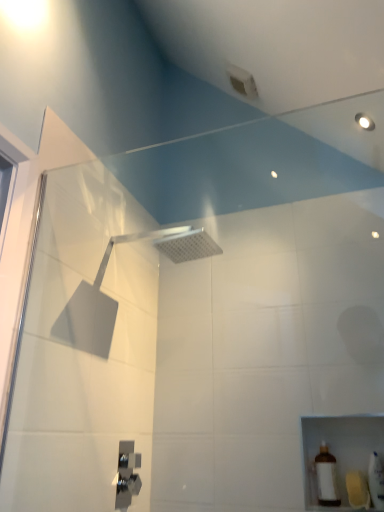
Image resolution: width=384 pixels, height=512 pixels. I want to click on white glossy bottle at lower right, acting as the first toiletry starting from the right, so click(376, 481).

This screenshot has width=384, height=512. What do you see at coordinates (376, 481) in the screenshot?
I see `white glossy bottle at lower right, acting as the first toiletry starting from the right` at bounding box center [376, 481].

This screenshot has height=512, width=384. Describe the element at coordinates (167, 246) in the screenshot. I see `silver metallic shower head at upper center, the first shower from the top` at that location.

The image size is (384, 512). Describe the element at coordinates (127, 474) in the screenshot. I see `satin nickel faucet at lower center, acting as the first shower starting from the bottom` at that location.

You are a GUI agent. You are given a task and a screenshot of the screen. Output one action in this format:
    pyautogui.click(x=<x>, y=<y>)
    Task: Click on the brown matte bottle at lower right, placed as the 1th toiletry when sorted from left to right
    
    Given the screenshot: What is the action you would take?
    pyautogui.click(x=327, y=477)

From the image's perspective, is satin nickel faucet at lower center, which appears as the 2th shower when viewed from the right, above silver metallic shower head at upper center, arranged as the 2th shower when viewed from the left?

No, from the image's perspective, satin nickel faucet at lower center, which appears as the 2th shower when viewed from the right, is not on top of silver metallic shower head at upper center, arranged as the 2th shower when viewed from the left.

Between satin nickel faucet at lower center, marked as the first shower in a left-to-right arrangement, and silver metallic shower head at upper center, the first shower from the top, which one has less height?

With less height is silver metallic shower head at upper center, the first shower from the top.

Which is behind, point (127, 466) or point (203, 234)?

The point (127, 466) is farther from the camera.

Find the location of a particular element. shower on the left of silver metallic shower head at upper center, marked as the second shower in a bottom-to-top arrangement is located at coordinates (127, 474).

Looking at this image, is white glossy bottle at lower right, the second toiletry when ordered from left to right, positioned far away from brown matte bottle at lower right, placed as the 1th toiletry when sorted from left to right?

Actually, white glossy bottle at lower right, the second toiletry when ordered from left to right, and brown matte bottle at lower right, placed as the 1th toiletry when sorted from left to right, are a little close together.

Which object is thinner, white glossy bottle at lower right, acting as the first toiletry starting from the right, or brown matte bottle at lower right, placed as the 1th toiletry when sorted from left to right?

brown matte bottle at lower right, placed as the 1th toiletry when sorted from left to right.

Looking at this image, is white glossy bottle at lower right, the second toiletry when ordered from left to right, facing away from brown matte bottle at lower right, placed as the 1th toiletry when sorted from left to right?

white glossy bottle at lower right, the second toiletry when ordered from left to right, is not turned away from brown matte bottle at lower right, placed as the 1th toiletry when sorted from left to right.

Does silver metallic shower head at upper center, the first shower from the top, have a larger size compared to brown matte bottle at lower right, placed as the 1th toiletry when sorted from left to right?

Correct, silver metallic shower head at upper center, the first shower from the top, is larger in size than brown matte bottle at lower right, placed as the 1th toiletry when sorted from left to right.

Visually, is silver metallic shower head at upper center, marked as the second shower in a bottom-to-top arrangement, positioned to the left or to the right of brown matte bottle at lower right, placed as the 1th toiletry when sorted from left to right?

In the image, silver metallic shower head at upper center, marked as the second shower in a bottom-to-top arrangement, appears on the left side of brown matte bottle at lower right, placed as the 1th toiletry when sorted from left to right.

Which is correct: silver metallic shower head at upper center, marked as the second shower in a bottom-to-top arrangement, is inside brown matte bottle at lower right, placed as the 1th toiletry when sorted from left to right, or outside of it?

silver metallic shower head at upper center, marked as the second shower in a bottom-to-top arrangement, is not enclosed by brown matte bottle at lower right, placed as the 1th toiletry when sorted from left to right.

From the image's perspective, is silver metallic shower head at upper center, marked as the second shower in a bottom-to-top arrangement, on top of brown matte bottle at lower right, placed as the 1th toiletry when sorted from left to right?

Yes, from the image's perspective, silver metallic shower head at upper center, marked as the second shower in a bottom-to-top arrangement, is over brown matte bottle at lower right, placed as the 1th toiletry when sorted from left to right.

Who is bigger, satin nickel faucet at lower center, acting as the first shower starting from the bottom, or brown matte bottle at lower right, placed as the 1th toiletry when sorted from left to right?

brown matte bottle at lower right, placed as the 1th toiletry when sorted from left to right.

Is brown matte bottle at lower right, placed as the 1th toiletry when sorted from left to right, inside satin nickel faucet at lower center, placed as the second shower when sorted from top to bottom?

No, brown matte bottle at lower right, placed as the 1th toiletry when sorted from left to right, is not surrounded by satin nickel faucet at lower center, placed as the second shower when sorted from top to bottom.

Is satin nickel faucet at lower center, which appears as the 2th shower when viewed from the right, in front of or behind brown matte bottle at lower right, placed as the 1th toiletry when sorted from left to right, in the image?

Clearly, satin nickel faucet at lower center, which appears as the 2th shower when viewed from the right, is in front of brown matte bottle at lower right, placed as the 1th toiletry when sorted from left to right.

Can you tell me how much satin nickel faucet at lower center, which appears as the 2th shower when viewed from the right, and brown matte bottle at lower right, placed as the 1th toiletry when sorted from left to right, differ in facing direction?

The angular difference between satin nickel faucet at lower center, which appears as the 2th shower when viewed from the right, and brown matte bottle at lower right, placed as the 1th toiletry when sorted from left to right, is 90 degrees.

Is satin nickel faucet at lower center, placed as the second shower when sorted from top to bottom, facing towards white glossy bottle at lower right, acting as the first toiletry starting from the right?

Yes.

Considering the points (128, 478) and (378, 492), which point is in front, point (128, 478) or point (378, 492)?

The point (378, 492) is more forward.

From their relative heights in the image, would you say satin nickel faucet at lower center, acting as the first shower starting from the bottom, is taller or shorter than white glossy bottle at lower right, the second toiletry when ordered from left to right?

Clearly, satin nickel faucet at lower center, acting as the first shower starting from the bottom, is taller compared to white glossy bottle at lower right, the second toiletry when ordered from left to right.

Is satin nickel faucet at lower center, marked as the first shower in a left-to-right arrangement, wider than white glossy bottle at lower right, the second toiletry when ordered from left to right?

Incorrect, the width of satin nickel faucet at lower center, marked as the first shower in a left-to-right arrangement, does not surpass that of white glossy bottle at lower right, the second toiletry when ordered from left to right.

Is white glossy bottle at lower right, the second toiletry when ordered from left to right, far away from satin nickel faucet at lower center, marked as the first shower in a left-to-right arrangement?

They are positioned close to each other.

Can you confirm if white glossy bottle at lower right, acting as the first toiletry starting from the right, is wider than satin nickel faucet at lower center, placed as the second shower when sorted from top to bottom?

Yes, white glossy bottle at lower right, acting as the first toiletry starting from the right, is wider than satin nickel faucet at lower center, placed as the second shower when sorted from top to bottom.

Considering the relative sizes of white glossy bottle at lower right, the second toiletry when ordered from left to right, and satin nickel faucet at lower center, which appears as the 2th shower when viewed from the right, in the image provided, is white glossy bottle at lower right, the second toiletry when ordered from left to right, bigger than satin nickel faucet at lower center, which appears as the 2th shower when viewed from the right,?

Yes, white glossy bottle at lower right, the second toiletry when ordered from left to right, is bigger than satin nickel faucet at lower center, which appears as the 2th shower when viewed from the right.

Is white glossy bottle at lower right, acting as the first toiletry starting from the right, closer to the viewer compared to satin nickel faucet at lower center, placed as the second shower when sorted from top to bottom?

Yes.

From a real-world perspective, is brown matte bottle at lower right, marked as the second toiletry in a right-to-left arrangement, above or below satin nickel faucet at lower center, marked as the first shower in a left-to-right arrangement?

Clearly, from a real-world perspective, brown matte bottle at lower right, marked as the second toiletry in a right-to-left arrangement, is below satin nickel faucet at lower center, marked as the first shower in a left-to-right arrangement.

Is brown matte bottle at lower right, marked as the second toiletry in a right-to-left arrangement, positioned with its back to satin nickel faucet at lower center, placed as the second shower when sorted from top to bottom?

brown matte bottle at lower right, marked as the second toiletry in a right-to-left arrangement, is not turned away from satin nickel faucet at lower center, placed as the second shower when sorted from top to bottom.

Which of these two, brown matte bottle at lower right, placed as the 1th toiletry when sorted from left to right, or satin nickel faucet at lower center, marked as the first shower in a left-to-right arrangement, is wider?

brown matte bottle at lower right, placed as the 1th toiletry when sorted from left to right.

From the image's perspective, count 1st showers upward from the brown matte bottle at lower right, marked as the second toiletry in a right-to-left arrangement, and point to it. Please provide its 2D coordinates.

[(127, 474)]

This screenshot has height=512, width=384. In order to click on shower that is above the satin nickel faucet at lower center, which appears as the 2th shower when viewed from the right (from a real-world perspective) in this screenshot , I will do `click(167, 246)`.

Image resolution: width=384 pixels, height=512 pixels. In order to click on toiletry lying on the right of brown matte bottle at lower right, marked as the second toiletry in a right-to-left arrangement in this screenshot , I will do `click(376, 481)`.

Based on their spatial positions, is white glossy bottle at lower right, acting as the first toiletry starting from the right, or silver metallic shower head at upper center, marked as the second shower in a bottom-to-top arrangement, further from brown matte bottle at lower right, placed as the 1th toiletry when sorted from left to right?

Among the two, silver metallic shower head at upper center, marked as the second shower in a bottom-to-top arrangement, is located further to brown matte bottle at lower right, placed as the 1th toiletry when sorted from left to right.

When comparing their distances from satin nickel faucet at lower center, placed as the second shower when sorted from top to bottom, does white glossy bottle at lower right, acting as the first toiletry starting from the right, or brown matte bottle at lower right, marked as the second toiletry in a right-to-left arrangement, seem closer?

brown matte bottle at lower right, marked as the second toiletry in a right-to-left arrangement, is positioned closer to the anchor satin nickel faucet at lower center, placed as the second shower when sorted from top to bottom.

Based on their spatial positions, is brown matte bottle at lower right, marked as the second toiletry in a right-to-left arrangement, or satin nickel faucet at lower center, marked as the first shower in a left-to-right arrangement, closer to silver metallic shower head at upper center, which is the first shower from right to left?

satin nickel faucet at lower center, marked as the first shower in a left-to-right arrangement, lies closer to silver metallic shower head at upper center, which is the first shower from right to left, than the other object.

From the image, which object appears to be nearer to silver metallic shower head at upper center, the first shower from the top, white glossy bottle at lower right, acting as the first toiletry starting from the right, or satin nickel faucet at lower center, placed as the second shower when sorted from top to bottom?

Based on the image, satin nickel faucet at lower center, placed as the second shower when sorted from top to bottom, appears to be nearer to silver metallic shower head at upper center, the first shower from the top.

From the image, which object appears to be nearer to white glossy bottle at lower right, acting as the first toiletry starting from the right, brown matte bottle at lower right, marked as the second toiletry in a right-to-left arrangement, or silver metallic shower head at upper center, the first shower from the top?

brown matte bottle at lower right, marked as the second toiletry in a right-to-left arrangement.

From the image, which object appears to be nearer to white glossy bottle at lower right, the second toiletry when ordered from left to right, silver metallic shower head at upper center, the first shower from the top, or satin nickel faucet at lower center, placed as the second shower when sorted from top to bottom?

satin nickel faucet at lower center, placed as the second shower when sorted from top to bottom, is positioned closer to the anchor white glossy bottle at lower right, the second toiletry when ordered from left to right.

When comparing their distances from satin nickel faucet at lower center, acting as the first shower starting from the bottom, does silver metallic shower head at upper center, which is the first shower from right to left, or white glossy bottle at lower right, the second toiletry when ordered from left to right, seem further?

white glossy bottle at lower right, the second toiletry when ordered from left to right, is positioned further to the anchor satin nickel faucet at lower center, acting as the first shower starting from the bottom.

Based on their spatial positions, is silver metallic shower head at upper center, marked as the second shower in a bottom-to-top arrangement, or brown matte bottle at lower right, placed as the 1th toiletry when sorted from left to right, further from white glossy bottle at lower right, acting as the first toiletry starting from the right?

silver metallic shower head at upper center, marked as the second shower in a bottom-to-top arrangement.

At what (x,y) coordinates should I click in order to perform the action: click on shower that lies between silver metallic shower head at upper center, which is the first shower from right to left, and brown matte bottle at lower right, placed as the 1th toiletry when sorted from left to right, from top to bottom. Please return your answer as a coordinate pair (x, y). This screenshot has width=384, height=512. Looking at the image, I should click on (127, 474).

This screenshot has width=384, height=512. I want to click on toiletry between satin nickel faucet at lower center, marked as the first shower in a left-to-right arrangement, and white glossy bottle at lower right, acting as the first toiletry starting from the right, so click(x=327, y=477).

This screenshot has height=512, width=384. Find the location of `toiletry between silver metallic shower head at upper center, which is the first shower from right to left, and brown matte bottle at lower right, marked as the second toiletry in a right-to-left arrangement, in the up-down direction`. toiletry between silver metallic shower head at upper center, which is the first shower from right to left, and brown matte bottle at lower right, marked as the second toiletry in a right-to-left arrangement, in the up-down direction is located at coordinates (376, 481).

This screenshot has width=384, height=512. I want to click on shower situated between satin nickel faucet at lower center, marked as the first shower in a left-to-right arrangement, and white glossy bottle at lower right, the second toiletry when ordered from left to right, from left to right, so click(x=167, y=246).